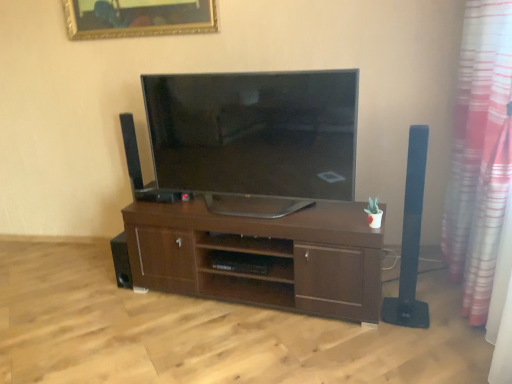
At what (x,y) coordinates should I click in order to perform the action: click on free location in front of brown wood cabinet at center. Please return your answer as a coordinate pair (x, y). The image size is (512, 384). Looking at the image, I should click on (265, 345).